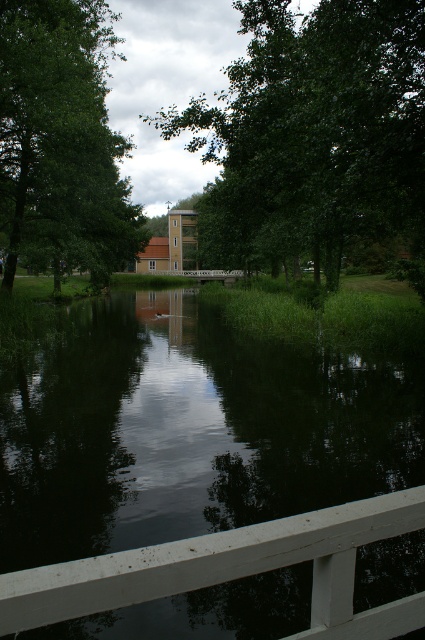
Question: Is dark reflective water at center above green leafy tree at upper left?

Choices:
 (A) yes
 (B) no

Answer: (B)

Question: Which object is farther from the camera taking this photo?

Choices:
 (A) dark reflective water at center
 (B) white painted wood rail at lower center

Answer: (A)

Question: Among these points, which one is nearest to the camera?

Choices:
 (A) (42, 4)
 (B) (17, 557)

Answer: (B)

Question: Can you confirm if dark reflective water at center is positioned above white painted wood rail at lower center?

Choices:
 (A) no
 (B) yes

Answer: (B)

Question: Is dark reflective water at center bigger than green leafy tree at center?

Choices:
 (A) no
 (B) yes

Answer: (A)

Question: Which object appears closest to the camera in this image?

Choices:
 (A) green leafy tree at upper left
 (B) white painted wood rail at lower center
 (C) dark reflective water at center

Answer: (B)